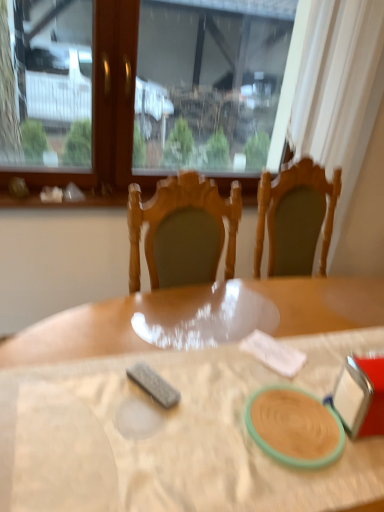
You are a GUI agent. You are given a task and a screenshot of the screen. Output one action in this format:
    pyautogui.click(x=<x>, y=<y>)
    Task: Click on the vacant area that is in front of matte green plate at center
    
    Given the screenshot: What is the action you would take?
    pyautogui.click(x=299, y=490)